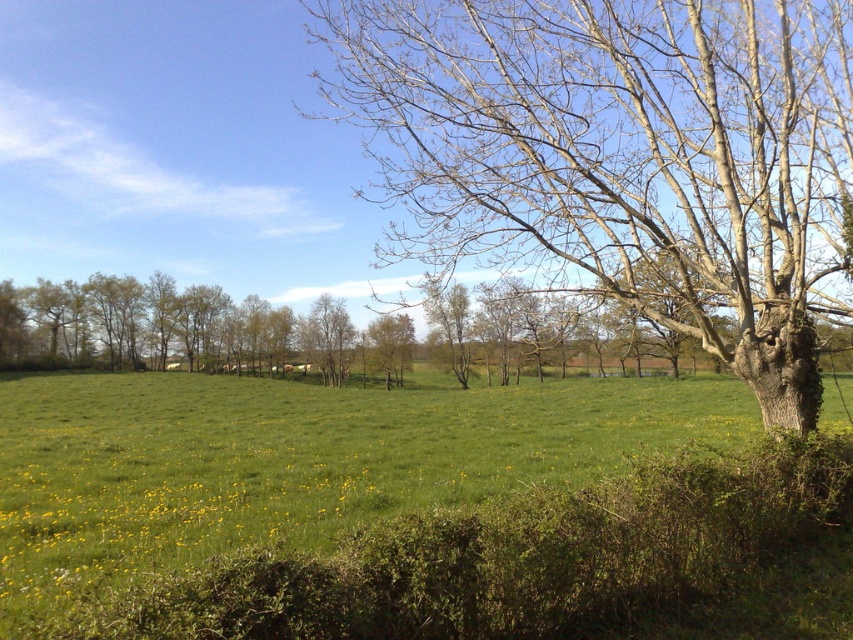
You are a landscape photographer planning to capture the entire scene in one shot. Given that your camera can only focus on one object at a time, which object between the bare wood tree at center and the green grassy pasture at center should you focus on to ensure the smaller one is in sharp detail?

The bare wood tree at center is smaller than the green grassy pasture at center, so you should focus on the bare wood tree at center to ensure the smaller one is in sharp detail.